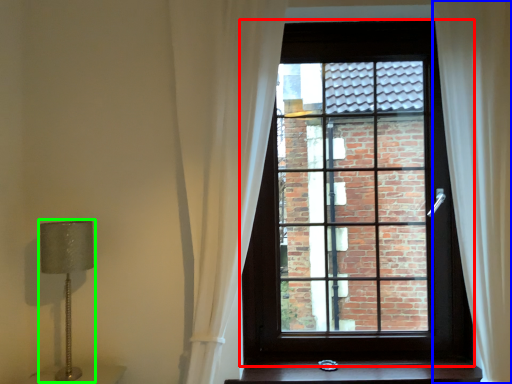
Question: Considering the real-world distances, which object is closest to window (highlighted by a red box)? curtain (highlighted by a blue box) or table lamp (highlighted by a green box).

Choices:
 (A) curtain
 (B) table lamp

Answer: (A)